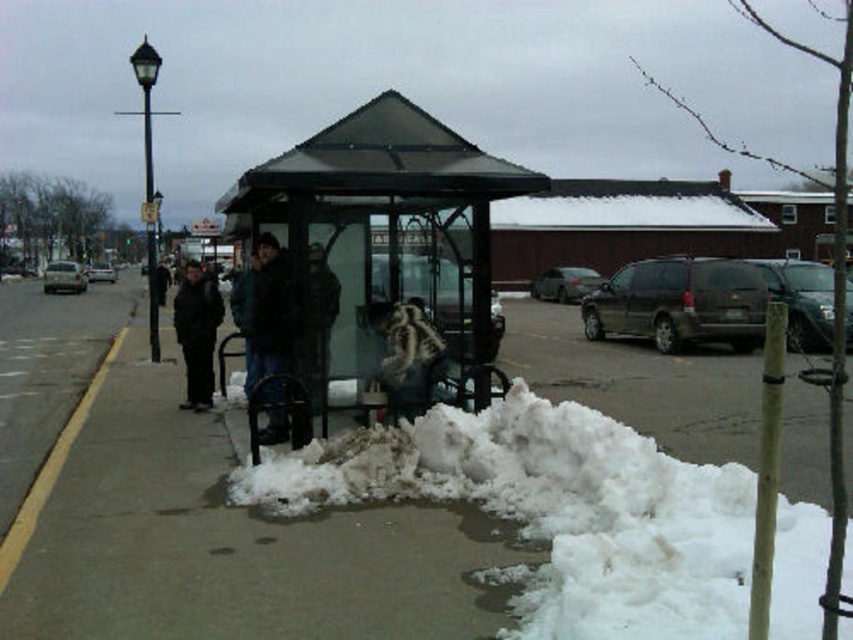
You are a delivery person with a package that needs to be placed on the ground. You see the white fluffy snow at lower center and the fuzzy fabric bag at center. Can you place the package between them without it touching either?

The distance between the white fluffy snow at lower center and the fuzzy fabric bag at center is 6.10 feet, so yes, you can place the package between them without it touching either since the space is sufficient.